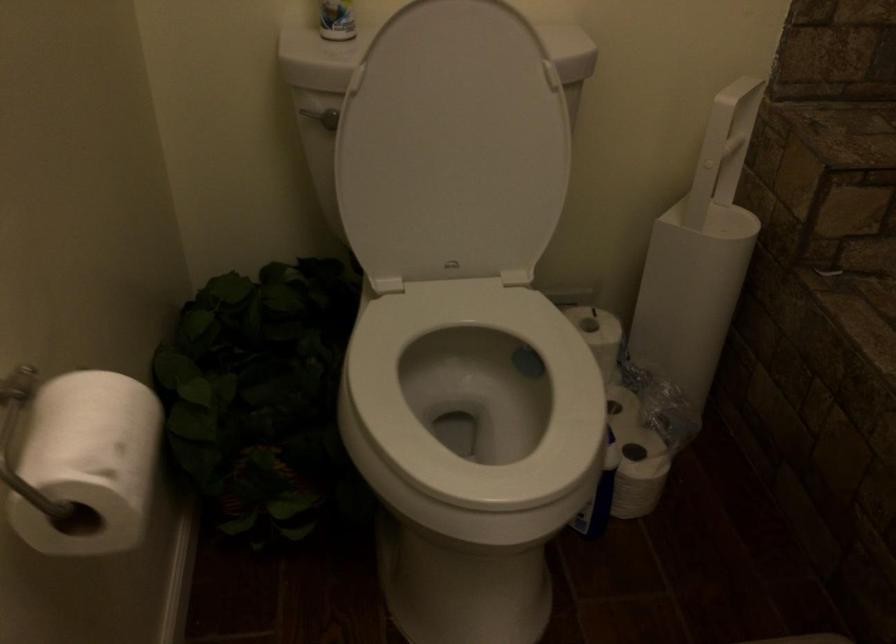
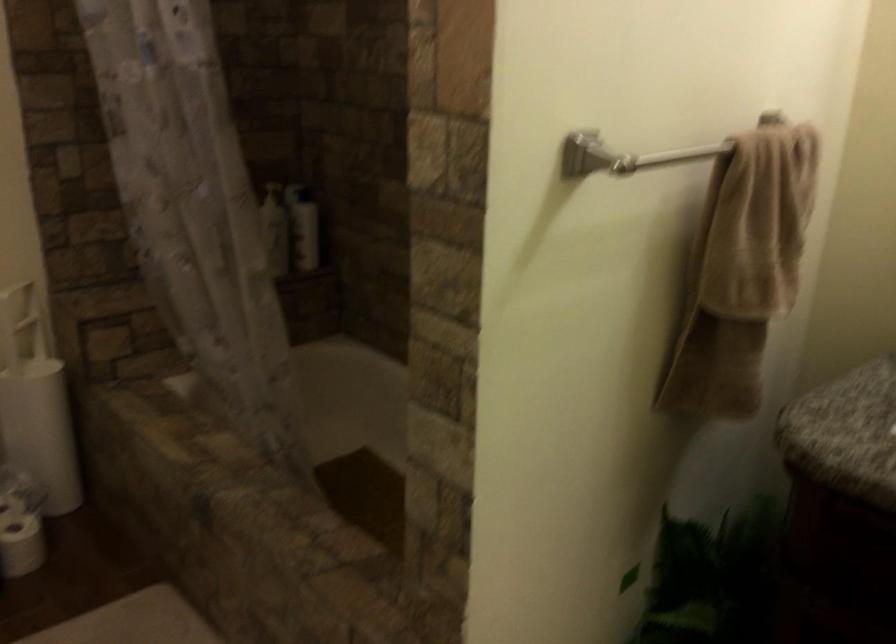
Locate, in the second image, the point that corresponds to (718,152) in the first image.

(20, 323)